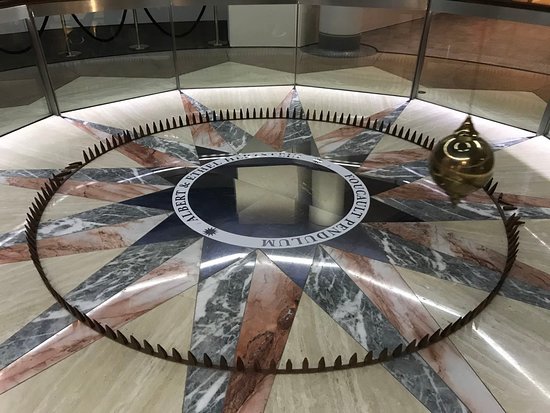
Locate an element on the screen. Image resolution: width=550 pixels, height=413 pixels. marble floor is located at coordinates (418, 241).